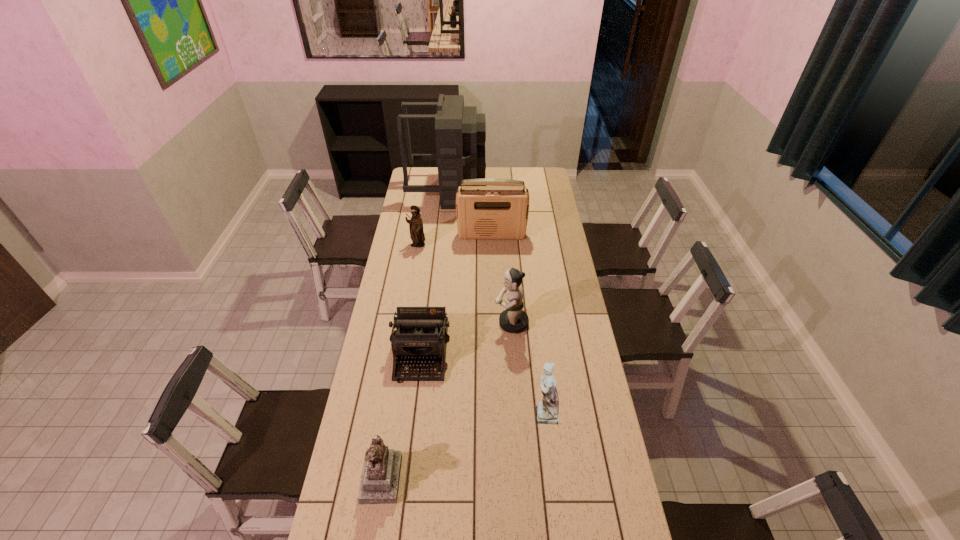
The image size is (960, 540). I want to click on backpack at the left edge, so click(460, 132).

Find the location of a particular element. This screenshot has width=960, height=540. typewriter present at the left edge is located at coordinates (421, 335).

Locate an element on the screen. object situated at the right edge is located at coordinates (547, 410).

Image resolution: width=960 pixels, height=540 pixels. I want to click on object located at the far left corner, so click(x=460, y=132).

In the image, there is a desktop. At what (x,y) coordinates should I click in order to perform the action: click on free space at the left edge. Please return your answer as a coordinate pair (x, y). This screenshot has height=540, width=960. Looking at the image, I should click on (404, 209).

In the image, there is a desktop. Where is `free region at the right edge`? Image resolution: width=960 pixels, height=540 pixels. free region at the right edge is located at coordinates (537, 188).

Identify the location of vacant space at the far left corner of the desktop. This screenshot has width=960, height=540. (421, 168).

This screenshot has width=960, height=540. Find the location of `vacant space at the far right corner of the desktop`. vacant space at the far right corner of the desktop is located at coordinates (526, 169).

Locate an element on the screen. This screenshot has height=540, width=960. unoccupied position between the radio receiver and the second farthest figurine is located at coordinates (501, 279).

What are the coordinates of `empty space between the third farthest figurine and the shortest object` in the screenshot? It's located at (483, 383).